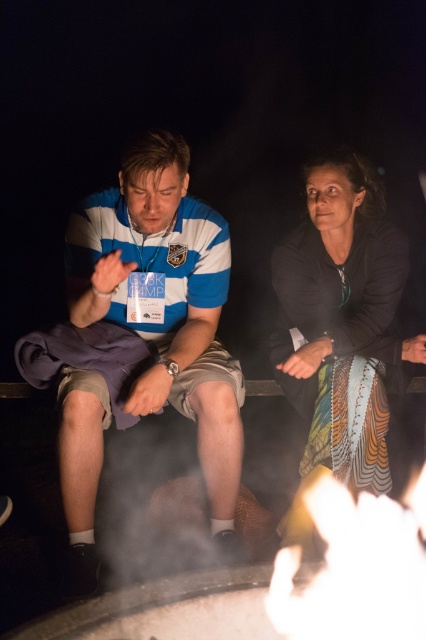
Question: Which point appears farthest from the camera in this image?

Choices:
 (A) (192, 262)
 (B) (293, 243)

Answer: (B)

Question: Is striped polo shirt at left bigger than black matte dress at center?

Choices:
 (A) yes
 (B) no

Answer: (A)

Question: Is striped polo shirt at left to the right of black matte dress at center from the viewer's perspective?

Choices:
 (A) yes
 (B) no

Answer: (B)

Question: Is striped polo shirt at left above black matte dress at center?

Choices:
 (A) yes
 (B) no

Answer: (B)

Question: Which point is closer to the camera?

Choices:
 (A) striped polo shirt at left
 (B) black matte dress at center

Answer: (A)

Question: Which object is closer to the camera taking this photo?

Choices:
 (A) black matte dress at center
 (B) striped polo shirt at left

Answer: (B)